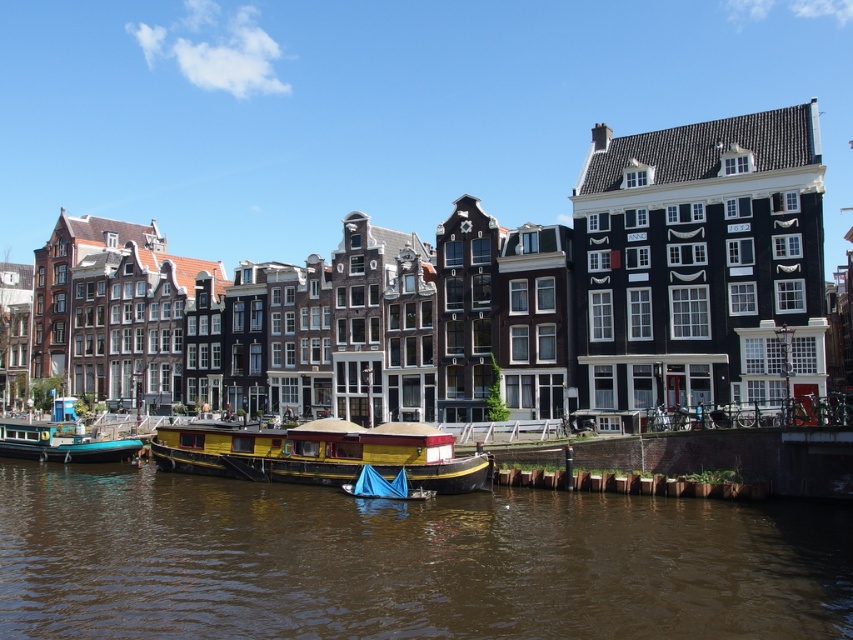
Question: Which of the following is the closest to the observer?

Choices:
 (A) brown water at lower center
 (B) yellow painted wood houseboat at center

Answer: (A)

Question: Can you confirm if yellow painted wood houseboat at center is positioned above teal glossy houseboat at lower left?

Choices:
 (A) no
 (B) yes

Answer: (B)

Question: Can you confirm if yellow painted wood houseboat at center is positioned above teal glossy houseboat at lower left?

Choices:
 (A) yes
 (B) no

Answer: (A)

Question: Which object is positioned closest to the yellow painted wood houseboat at center?

Choices:
 (A) brown water at lower center
 (B) teal glossy houseboat at lower left

Answer: (A)

Question: Which is farther from the yellow painted wood houseboat at center?

Choices:
 (A) brown water at lower center
 (B) teal glossy houseboat at lower left

Answer: (B)

Question: Does yellow painted wood houseboat at center have a greater width compared to teal glossy houseboat at lower left?

Choices:
 (A) yes
 (B) no

Answer: (A)